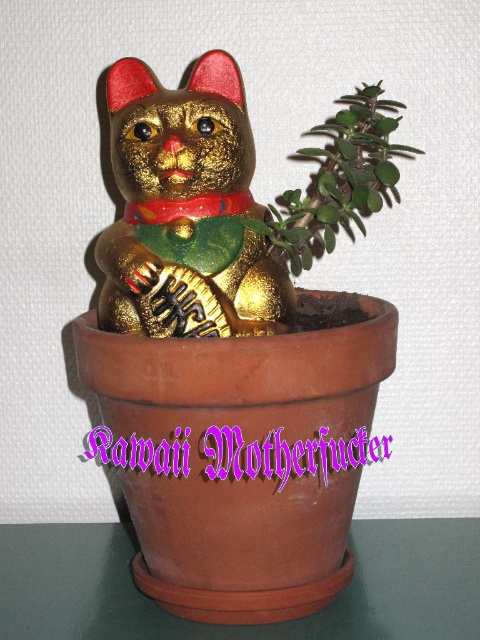
What are the coordinates of the gold shiny cat at center?

The gold shiny cat at center is located at point (186, 209).

You are standing in front of the terracotta pot and see the gold shiny cat at center and the green matte plant at upper right. Which object is positioned to the left of the other?

The gold shiny cat at center is positioned to the left of the green matte plant at upper right.

You are a visitor in a garden and see the gold shiny cat at center and the green matte plant at upper right. Which object is smaller in size?

The gold shiny cat at center is smaller in size compared to the green matte plant at upper right.